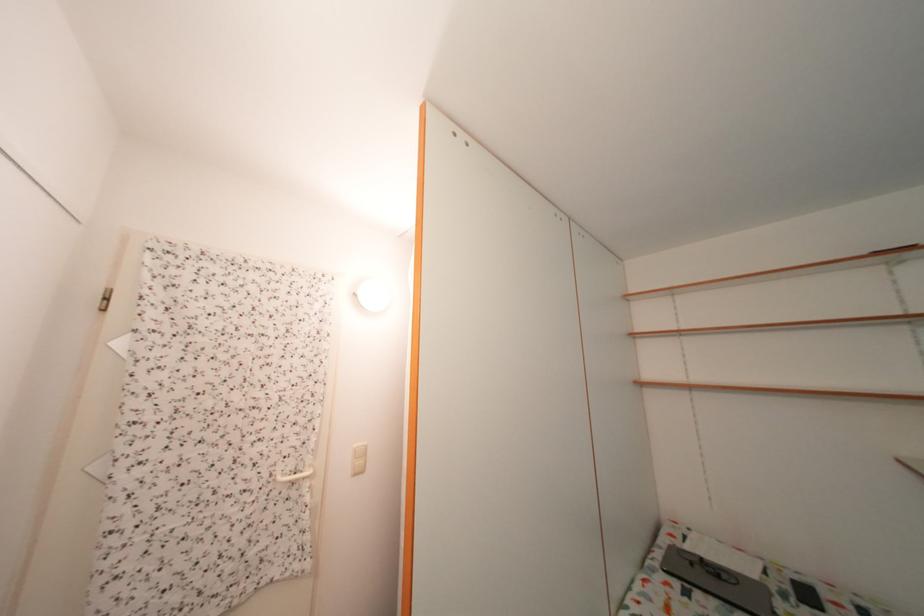
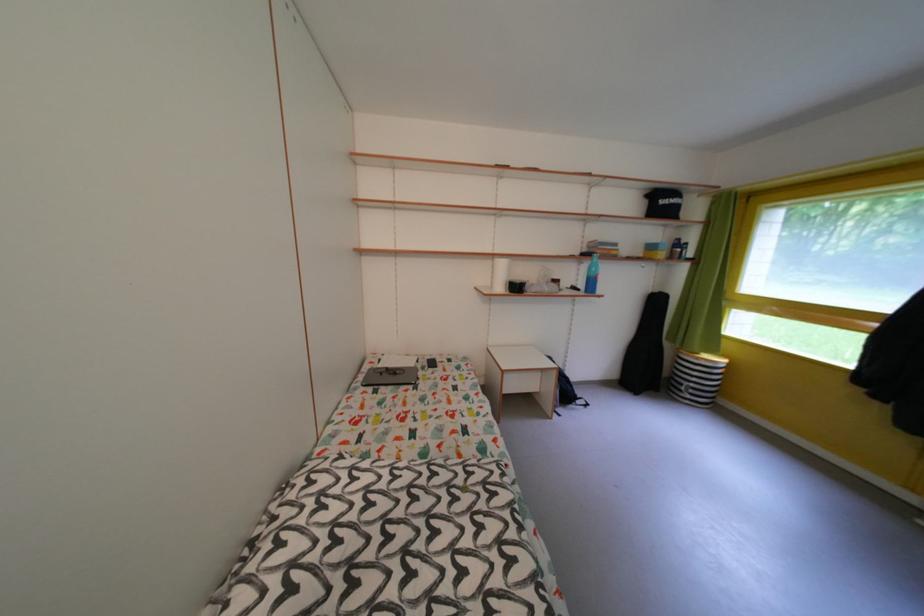
Find the pixel in the second image that matches [697,553] in the first image.

(391, 371)